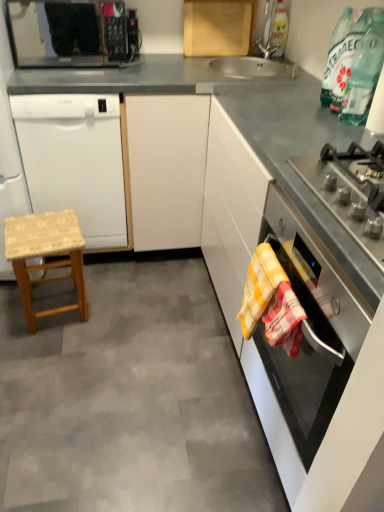
You are a GUI agent. You are given a task and a screenshot of the screen. Output one action in this format:
    pyautogui.click(x=<x>, y=<y>)
    Task: Click on the empty space that is ontop of wooden stool at left
    
    Given the screenshot: What is the action you would take?
    pyautogui.click(x=109, y=369)